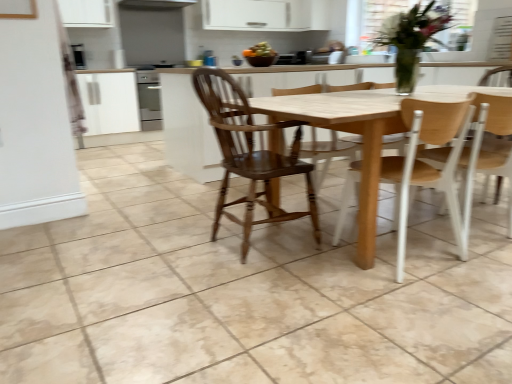
Locate an element on the screen. The image size is (512, 384). vacant space that is to the left of light wood table at center is located at coordinates pyautogui.click(x=131, y=241).